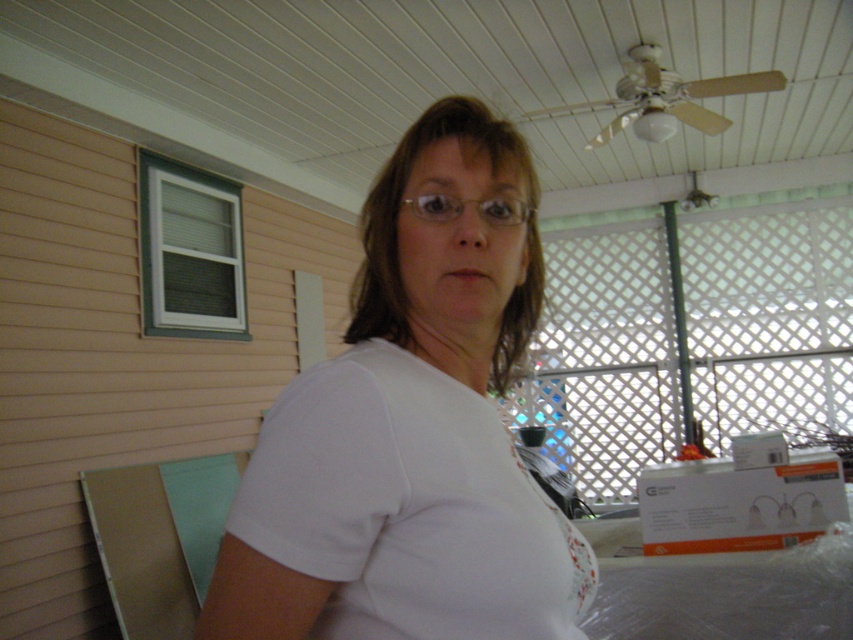
Question: From the image, what is the correct spatial relationship of white cotton t-shirt at center in relation to gold-framed glasses at center?

Choices:
 (A) above
 (B) below

Answer: (B)

Question: Does white cotton t-shirt at center appear on the right side of gold-framed glasses at center?

Choices:
 (A) no
 (B) yes

Answer: (A)

Question: Which of the following is the closest to the observer?

Choices:
 (A) (424, 198)
 (B) (421, 486)

Answer: (B)

Question: Which object appears closest to the camera in this image?

Choices:
 (A) gold-framed glasses at center
 (B) white cotton t-shirt at center

Answer: (B)

Question: Which point appears farthest from the camera in this image?

Choices:
 (A) (360, 376)
 (B) (462, 211)

Answer: (B)

Question: Does white cotton t-shirt at center appear under gold-framed glasses at center?

Choices:
 (A) no
 (B) yes

Answer: (B)